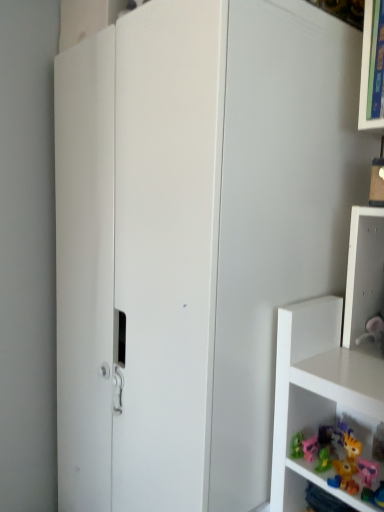
Question: From a real-world perspective, does white plastic shelf at right stand above pink plastic toy at lower right?

Choices:
 (A) no
 (B) yes

Answer: (B)

Question: Is white plastic shelf at right not within pink plastic toy at lower right?

Choices:
 (A) yes
 (B) no

Answer: (A)

Question: Does white plastic shelf at right appear on the left side of pink plastic toy at lower right?

Choices:
 (A) yes
 (B) no

Answer: (B)

Question: Is white plastic shelf at right positioned behind pink plastic toy at lower right?

Choices:
 (A) no
 (B) yes

Answer: (A)

Question: Is white plastic shelf at right facing away from pink plastic toy at lower right?

Choices:
 (A) no
 (B) yes

Answer: (A)

Question: Is white plastic shelf at right closer to camera compared to pink plastic toy at lower right?

Choices:
 (A) no
 (B) yes

Answer: (B)

Question: From a real-world perspective, is pink plastic toy at lower right physically below white plastic shelf at right?

Choices:
 (A) no
 (B) yes

Answer: (B)

Question: Is pink plastic toy at lower right positioned beyond the bounds of white plastic shelf at right?

Choices:
 (A) yes
 (B) no

Answer: (A)

Question: Is pink plastic toy at lower right oriented away from white plastic shelf at right?

Choices:
 (A) yes
 (B) no

Answer: (B)

Question: Is pink plastic toy at lower right further to camera compared to white plastic shelf at right?

Choices:
 (A) yes
 (B) no

Answer: (A)

Question: Is pink plastic toy at lower right not close to white plastic shelf at right?

Choices:
 (A) yes
 (B) no

Answer: (B)

Question: Does pink plastic toy at lower right turn towards white plastic shelf at right?

Choices:
 (A) no
 (B) yes

Answer: (A)

Question: From a real-world perspective, is pink plastic toy at lower right physically located above or below white plastic shelf at right?

Choices:
 (A) above
 (B) below

Answer: (B)